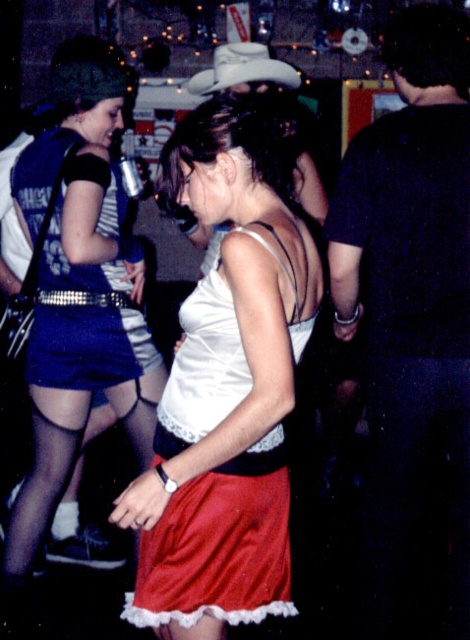
Question: Which point appears farthest from the camera in this image?

Choices:
 (A) (171, 611)
 (B) (48, 186)

Answer: (B)

Question: Does white satin tank top at center have a greater width compared to matte black dress at center?

Choices:
 (A) no
 (B) yes

Answer: (A)

Question: Which point is closer to the camera?

Choices:
 (A) white satin tank top at center
 (B) matte black dress at center

Answer: (A)

Question: Is white satin tank top at center wider than matte black dress at center?

Choices:
 (A) yes
 (B) no

Answer: (B)

Question: Among these objects, which one is nearest to the camera?

Choices:
 (A) matte black dress at center
 (B) white satin tank top at center

Answer: (B)

Question: Can you confirm if white satin tank top at center is positioned to the left of matte black dress at center?

Choices:
 (A) no
 (B) yes

Answer: (A)